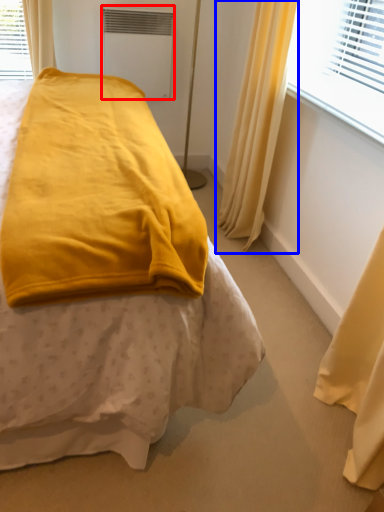
Question: Which of the following is the farthest to the observer, air conditioning (highlighted by a red box) or curtain (highlighted by a blue box)?

Choices:
 (A) air conditioning
 (B) curtain

Answer: (A)